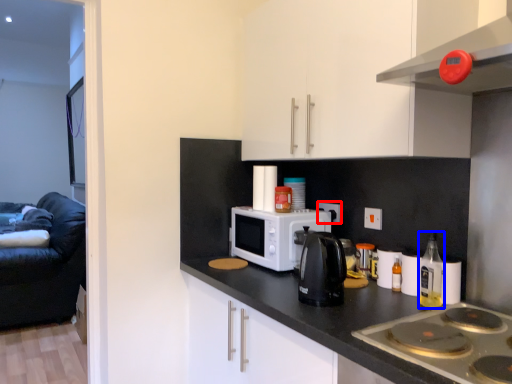
Question: Which object is closer to the camera taking this photo, electric outlet (highlighted by a red box) or bottle (highlighted by a blue box)?

Choices:
 (A) electric outlet
 (B) bottle

Answer: (B)